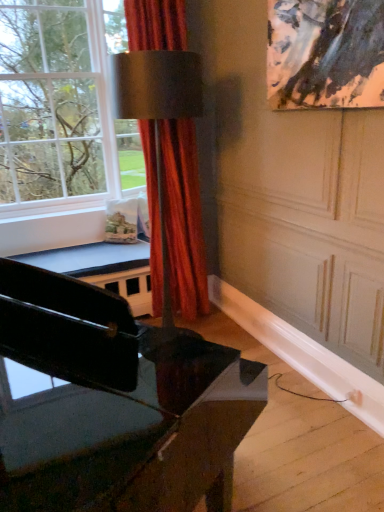
Question: Would you say clear glass window at upper left is inside or outside black glossy piano at lower left?

Choices:
 (A) outside
 (B) inside

Answer: (A)

Question: Looking at the image, does clear glass window at upper left seem bigger or smaller compared to black glossy piano at lower left?

Choices:
 (A) small
 (B) big

Answer: (B)

Question: Which object is positioned closest to the black glossy piano at lower left?

Choices:
 (A) clear glass window at upper left
 (B) satin red curtain at center

Answer: (B)

Question: Based on their relative distances, which object is farther from the satin red curtain at center?

Choices:
 (A) clear glass window at upper left
 (B) black glossy piano at lower left

Answer: (B)